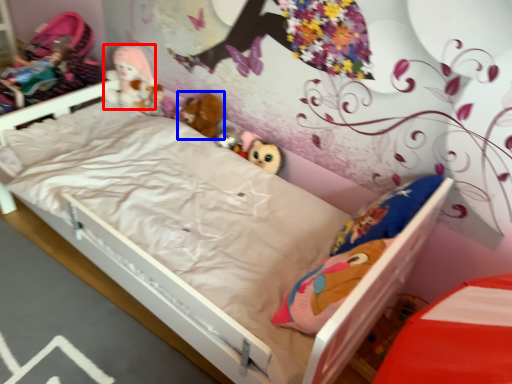
Question: Which of the following is the farthest to the observer, doll (highlighted by a red box) or doll (highlighted by a blue box)?

Choices:
 (A) doll
 (B) doll

Answer: (A)